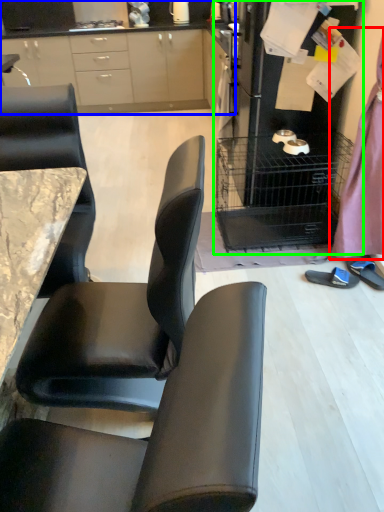
Question: Which is farther away from dress (highlighted by a red box)? cabinetry (highlighted by a blue box) or appliance (highlighted by a green box)?

Choices:
 (A) cabinetry
 (B) appliance

Answer: (A)